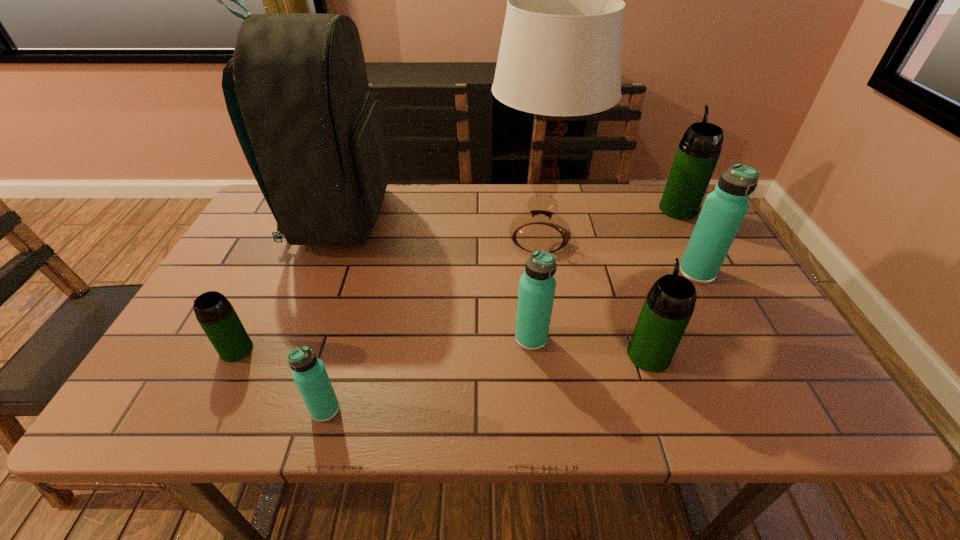
I want to click on vacant space located from the spout of the fourth thermos bottle from left to right, so click(x=606, y=231).

You are a GUI agent. You are given a task and a screenshot of the screen. Output one action in this format:
    pyautogui.click(x=<x>, y=<y>)
    Task: Click on the vacant region located 0.330m from the spout of the fourth thermos bottle from left to right
    
    Given the screenshot: What is the action you would take?
    pyautogui.click(x=611, y=245)

The width and height of the screenshot is (960, 540). I want to click on vacant region located 0.190m from the spout of the fourth thermos bottle from left to right, so click(x=623, y=279).

The width and height of the screenshot is (960, 540). What are the coordinates of `free space located 0.110m on the back of the second smallest aqua thermos bottle` in the screenshot? It's located at (526, 292).

The width and height of the screenshot is (960, 540). Find the location of `vacant space located 0.110m from the spout of the smallest green thermos bottle`. vacant space located 0.110m from the spout of the smallest green thermos bottle is located at coordinates (206, 410).

Find the location of a particular element. The width and height of the screenshot is (960, 540). vacant space located 0.130m on the back of the nearest thermos bottle is located at coordinates (344, 345).

Where is `backpack located at the far edge`? Image resolution: width=960 pixels, height=540 pixels. backpack located at the far edge is located at coordinates (311, 131).

What are the coordinates of `table lamp present at the far edge` in the screenshot? It's located at (560, 55).

This screenshot has width=960, height=540. In order to click on thermos bottle located at the far edge in this screenshot , I will do `click(698, 152)`.

Locate an element on the screen. object that is positioned at the near edge is located at coordinates (309, 373).